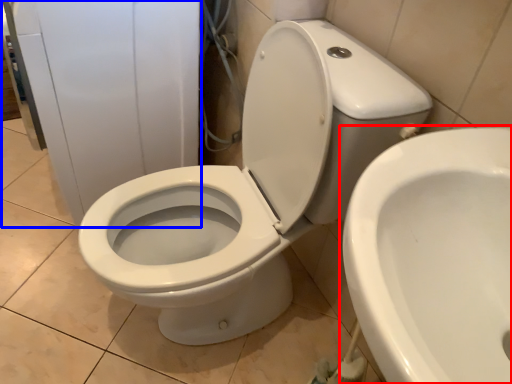
Question: Which object is closer to the camera taking this photo, toilet (highlighted by a red box) or porcelain (highlighted by a blue box)?

Choices:
 (A) toilet
 (B) porcelain

Answer: (A)